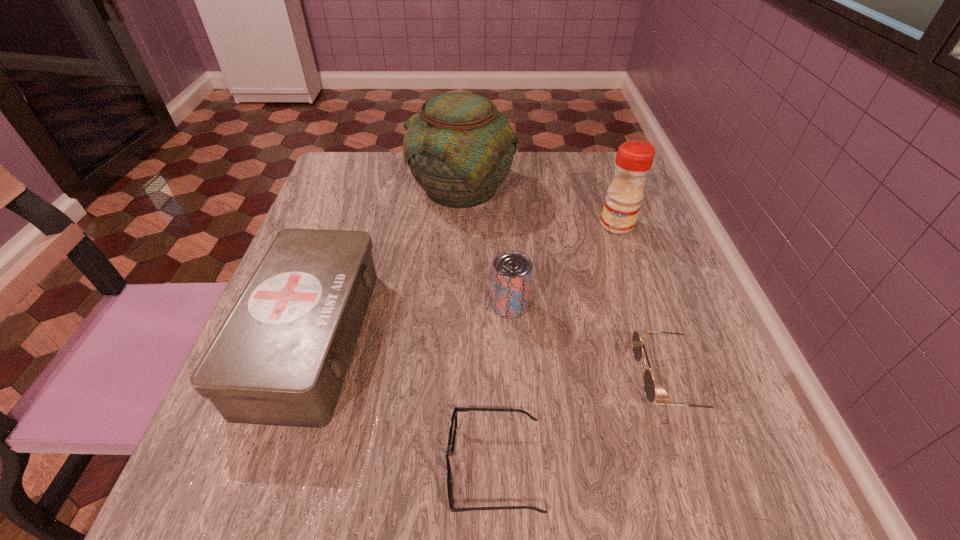
At what (x,y) coordinates should I click in order to perform the action: click on pottery. Please return your answer as a coordinate pair (x, y). This screenshot has height=540, width=960. Looking at the image, I should click on (459, 147).

Find the location of a particular element. Image resolution: width=960 pixels, height=540 pixels. condiment is located at coordinates (634, 159).

Locate an element on the screen. This screenshot has width=960, height=540. beer can is located at coordinates (512, 270).

Image resolution: width=960 pixels, height=540 pixels. Find the location of `the leftmost object`. the leftmost object is located at coordinates (281, 356).

The width and height of the screenshot is (960, 540). I want to click on the fifth tallest object, so click(x=638, y=337).

The height and width of the screenshot is (540, 960). In order to click on the shortest object in this screenshot , I will do `click(454, 420)`.

The height and width of the screenshot is (540, 960). In order to click on free space located 0.140m on the left of the pottery in this screenshot , I will do `click(352, 187)`.

What are the coordinates of `blank space located 0.380m on the front of the condiment` in the screenshot? It's located at (674, 387).

The height and width of the screenshot is (540, 960). I want to click on free space located 0.190m on the back of the beer can, so click(x=505, y=230).

Locate an element on the screen. The width and height of the screenshot is (960, 540). vacant area situated 0.350m on the right of the first-aid kit is located at coordinates (565, 337).